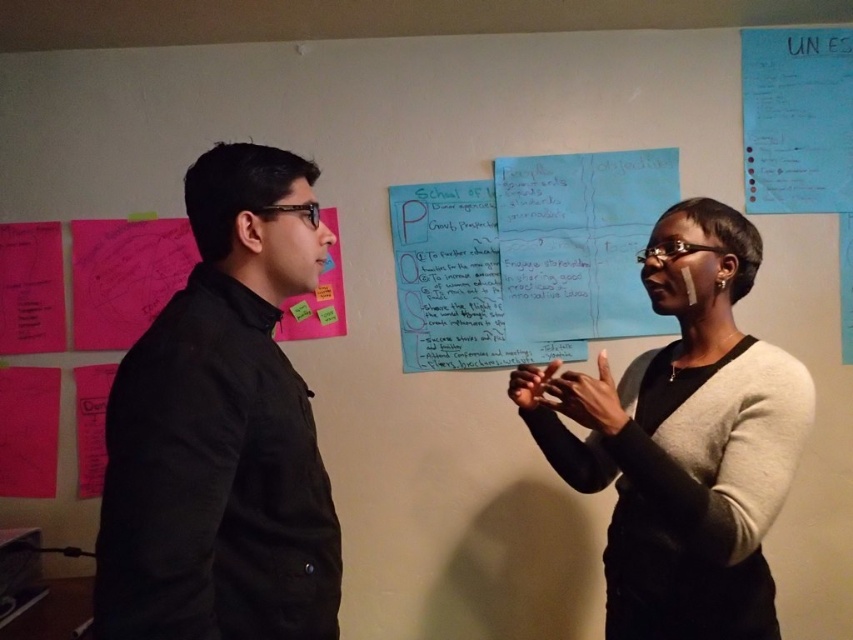
Can you confirm if black matte jacket at left is positioned to the left of black matte sweater at center?

Correct, you'll find black matte jacket at left to the left of black matte sweater at center.

Between point (289, 164) and point (758, 442), which one is positioned behind?

The point (758, 442) is more distant.

Identify the location of black matte jacket at left. (222, 429).